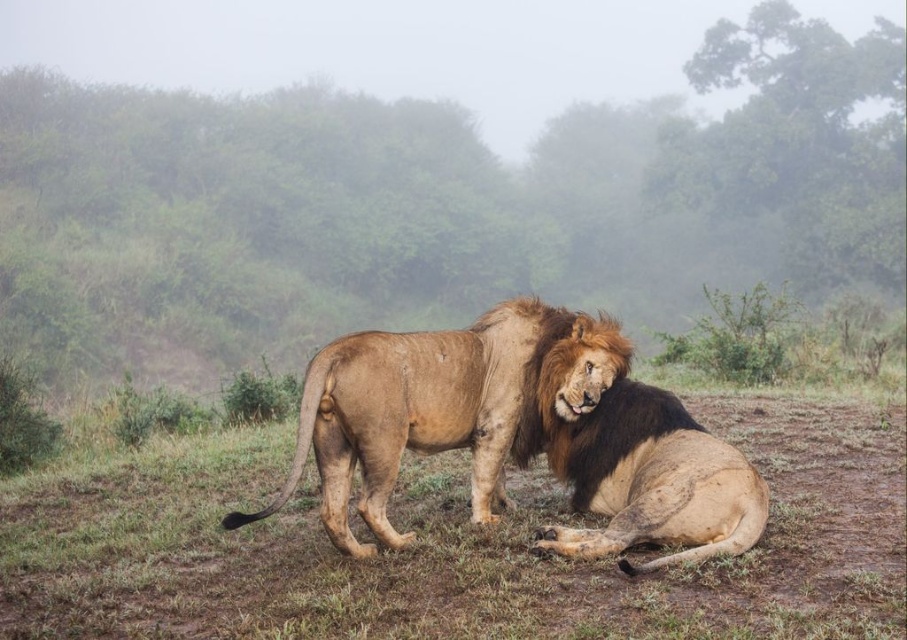
In the scene shown: You are a wildlife photographer trying to capture a photo of both the fuzzy brown lion at center and the brown shaggy lion at center. Which lion should you focus on first if you want to photograph the one that is closer to the camera?

The fuzzy brown lion at center is below the brown shaggy lion at center, so the fuzzy brown lion at center is closer to the camera. You should focus on the fuzzy brown lion at center first.

You are a wildlife photographer aiming to capture a closeup of the fuzzy brown lion at center. You are currently positioned at the point with coordinates point (454,545). Which direction should you move to get closer to the fuzzy brown lion at center?

Since the point (454,545) indicates the location of the fuzzy brown lion at center, you are already at the position of the fuzzy brown lion at center. Therefore, you don not need to move in any direction to get closer.

You are a wildlife photographer trying to capture a photo of both the fuzzy brown lion at center and the brown shaggy lion at center. If your camera has a maximum focus range of 3 feet, will you be able to capture both lions in focus at the same time?

The distance between the fuzzy brown lion at center and the brown shaggy lion at center is 3.64 feet. Since the camera can only focus up to 3 feet, you won